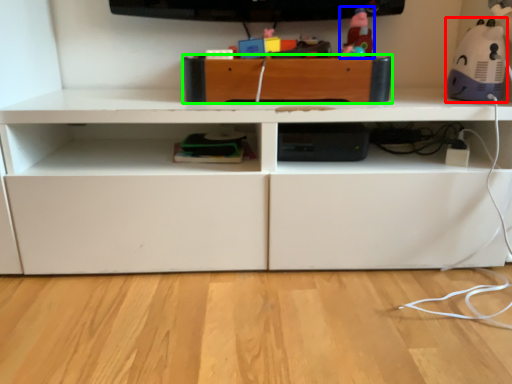
Question: Considering the real-world distances, which object is closest to toy (highlighted by a red box)? toy (highlighted by a blue box) or drawer (highlighted by a green box).

Choices:
 (A) toy
 (B) drawer

Answer: (A)